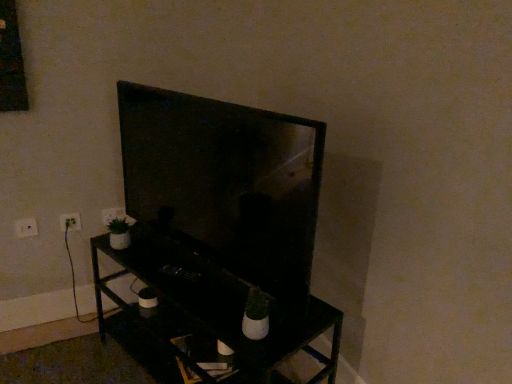
Question: Can we say matte black tv at center lies outside white plastic electric outlet at left, the 2th electric outlet positioned from the back?

Choices:
 (A) yes
 (B) no

Answer: (A)

Question: From a real-world perspective, is matte black tv at center located higher than white plastic electric outlet at left, positioned as the second electric outlet in right-to-left order?

Choices:
 (A) yes
 (B) no

Answer: (A)

Question: From the image's perspective, is matte black tv at center located above white plastic electric outlet at left, which is the second electric outlet from front to back?

Choices:
 (A) yes
 (B) no

Answer: (A)

Question: Would you say matte black tv at center contains white plastic electric outlet at left, the 2th electric outlet positioned from the back?

Choices:
 (A) no
 (B) yes

Answer: (A)

Question: Does matte black tv at center appear on the right side of white plastic electric outlet at left, which is the second electric outlet from front to back?

Choices:
 (A) no
 (B) yes

Answer: (B)

Question: From the image's perspective, is black matte tv stand at center positioned above or below matte black tv at center?

Choices:
 (A) below
 (B) above

Answer: (A)

Question: Would you say black matte tv stand at center is inside or outside matte black tv at center?

Choices:
 (A) inside
 (B) outside

Answer: (B)

Question: Is point (307, 317) positioned closer to the camera than point (284, 162)?

Choices:
 (A) farther
 (B) closer

Answer: (A)

Question: Considering the positions of black matte tv stand at center and matte black tv at center in the image, is black matte tv stand at center bigger or smaller than matte black tv at center?

Choices:
 (A) big
 (B) small

Answer: (A)

Question: Considering the positions of point (69, 215) and point (120, 208), is point (69, 215) closer or farther from the camera than point (120, 208)?

Choices:
 (A) closer
 (B) farther

Answer: (A)

Question: In the image, is white plastic electric outlet at left, the 2th electric outlet positioned from the back, positioned in front of or behind white plastic electric outlet at lower left, which ranks as the first electric outlet in right-to-left order?

Choices:
 (A) front
 (B) behind

Answer: (A)

Question: Is white plastic electric outlet at left, the 2th electric outlet positioned from the back, situated inside white plastic electric outlet at lower left, the third electric outlet when ordered from left to right, or outside?

Choices:
 (A) inside
 (B) outside

Answer: (B)

Question: Considering the positions of white plastic electric outlet at left, positioned as the 2th electric outlet in left-to-right order, and white plastic electric outlet at lower left, the 3th electric outlet positioned from the front, in the image, is white plastic electric outlet at left, positioned as the 2th electric outlet in left-to-right order, bigger or smaller than white plastic electric outlet at lower left, the 3th electric outlet positioned from the front,?

Choices:
 (A) small
 (B) big

Answer: (A)

Question: From the image's perspective, relative to white plastic electric outlet at left, positioned as the 2th electric outlet in left-to-right order, is white plastic electric outlet at lower left, which is counted as the first electric outlet, starting from the left, above or below?

Choices:
 (A) below
 (B) above

Answer: (A)

Question: Is point (22, 236) positioned closer to the camera than point (77, 226)?

Choices:
 (A) farther
 (B) closer

Answer: (B)